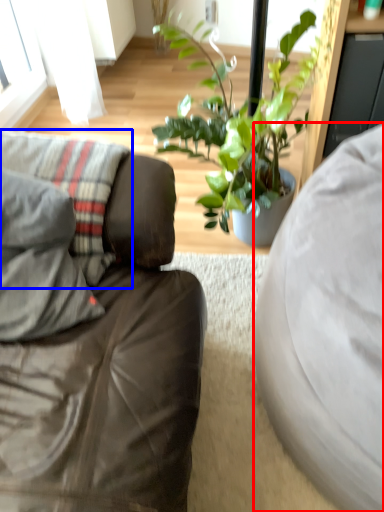
Question: Which of the following is the closest to the observer, studio couch (highlighted by a red box) or pillow (highlighted by a blue box)?

Choices:
 (A) studio couch
 (B) pillow

Answer: (A)